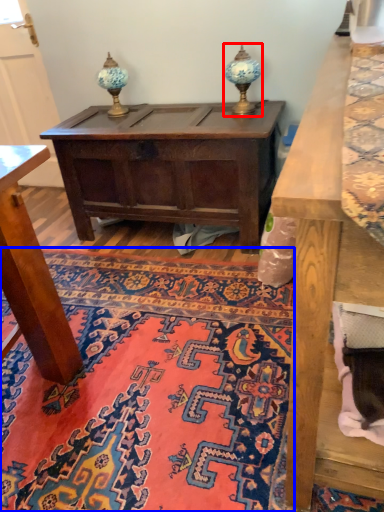
Question: Among these objects, which one is nearest to the camera, table lamp (highlighted by a red box) or mat (highlighted by a blue box)?

Choices:
 (A) table lamp
 (B) mat

Answer: (B)